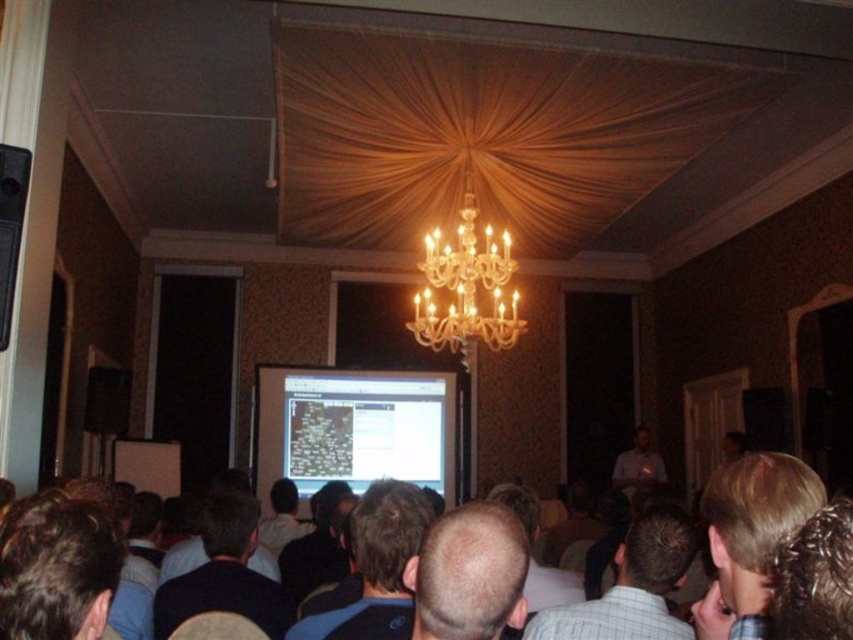
You are standing at the back of the room and want to see the white glossy projection screen at center clearly. Considering the distance between you and the screen is 7.07 meters, is this distance within the recommended viewing distance for a typical presentation screen?

The recommended viewing distance for a typical presentation screen is usually between 1.5 to 2.5 times the diagonal screen size. Since the distance between you and the white glossy projection screen at center is 7.07 meters, it depends on the screen size. However, without knowing the screen size, it is impossible to determine if this distance is within the recommended range.

You are an event planner checking the setup for a presentation. You need to ensure that the bald head at center does not block the view of the white glossy projection screen at center. Based on their sizes, is this likely to be a problem?

The white glossy projection screen at center has a larger size compared to bald head at center, so the bald head at center is unlikely to block the entire screen. However, it might partially obstruct the view depending on its position.